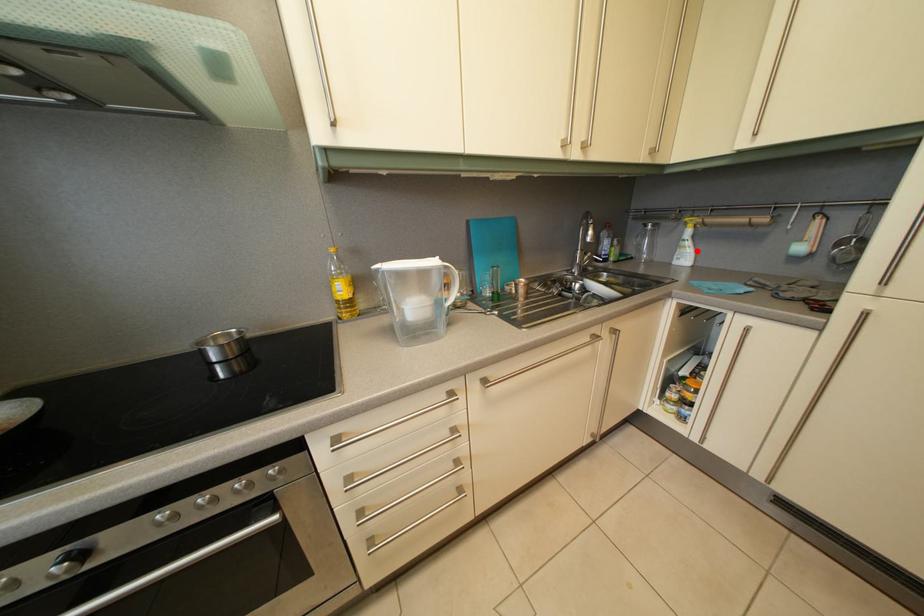
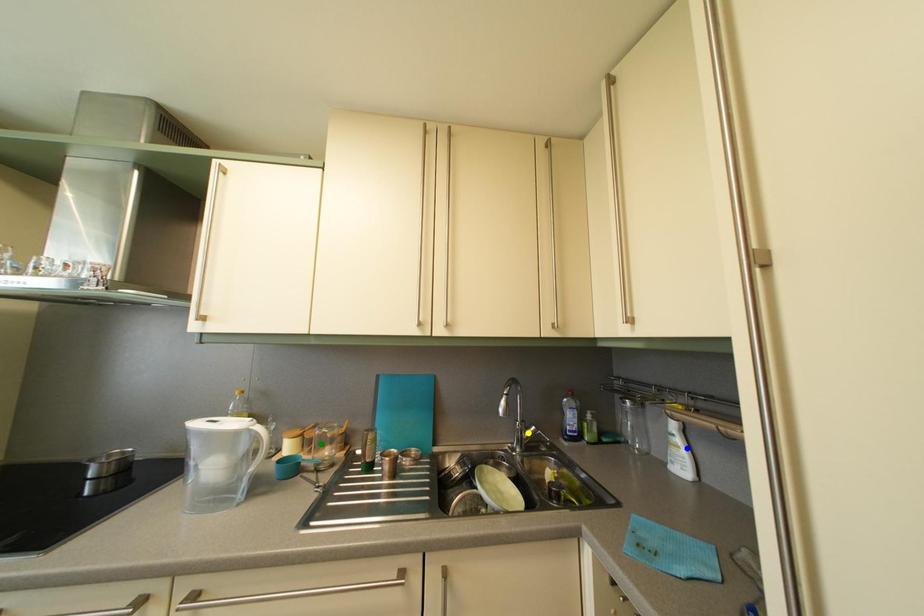
Question: I am providing you with two images of the same scene from different viewpoints. A red point is marked on the first image. You are given multiple points on the second image. Which mark in image 2 goes with the point in image 1?

Choices:
 (A) yellow point
 (B) blue point
 (C) green point

Answer: (B)